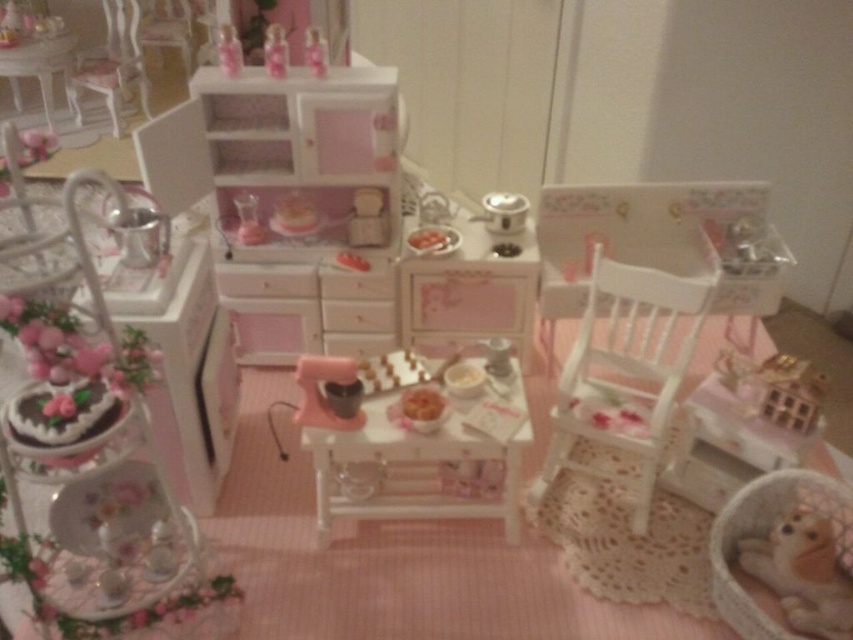
Question: Can you confirm if white wood chair at upper left is positioned to the left of matte plastic cabinet at upper center?

Choices:
 (A) no
 (B) yes

Answer: (B)

Question: Does matte pink cabinet at upper center appear under matte pink glass at upper center?

Choices:
 (A) no
 (B) yes

Answer: (B)

Question: Considering the real-world distances, which object is closest to the transparent glass at center?

Choices:
 (A) white wooden chair at center
 (B) matte pink glass at upper center
 (C) white glossy table at upper left

Answer: (B)

Question: Which point is farther from the camera taking this photo?

Choices:
 (A) (222, 42)
 (B) (312, 28)

Answer: (B)

Question: Does fluffy beige dog at lower right appear on the left side of transparent glass at center?

Choices:
 (A) yes
 (B) no

Answer: (B)

Question: Which point is farther to the camera?

Choices:
 (A) (776, 593)
 (B) (64, 35)
 (C) (398, 451)
 (D) (553, 476)

Answer: (B)